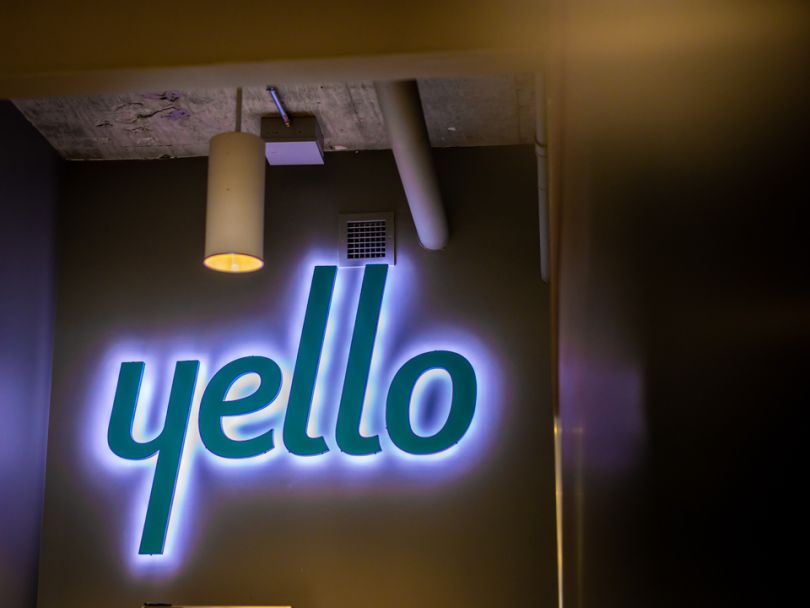
Locate an element on the screen. white metallic vent cover is located at coordinates (360, 233).